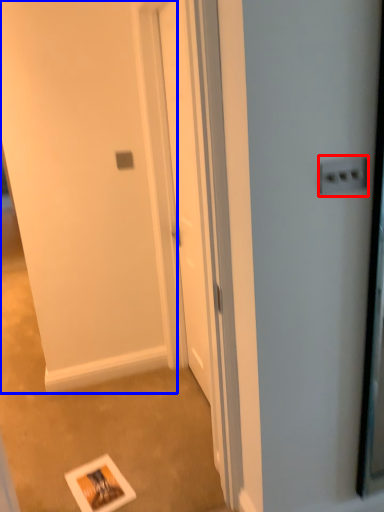
Question: Which object is closer to the camera taking this photo, electric outlet (highlighted by a red box) or screen door (highlighted by a blue box)?

Choices:
 (A) electric outlet
 (B) screen door

Answer: (B)